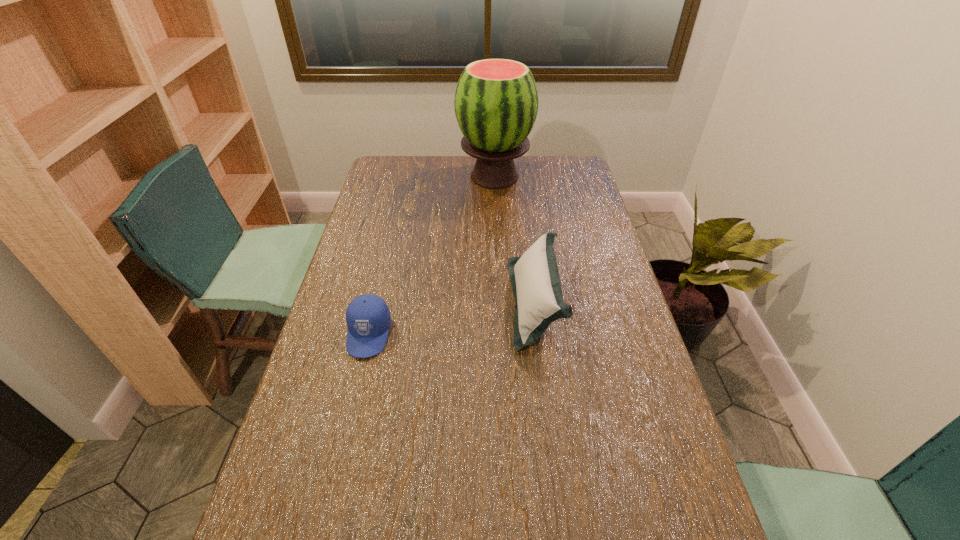
Locate which object is the closest to the second shortest object. Please provide its 2D coordinates. Your answer should be formatted as a tuple, i.e. [(x, y)], where the tuple contains the x and y coordinates of a point satisfying the conditions above.

[(368, 319)]

Point out which object is positioned as the nearest to the leftmost object. Please provide its 2D coordinates. Your answer should be formatted as a tuple, i.e. [(x, y)], where the tuple contains the x and y coordinates of a point satisfying the conditions above.

[(534, 276)]

Find the location of `free space in the image that satisfies the following two spatial constraints: 1. on the surface of the second tallest object; 2. on the front-facing side of the cap`. free space in the image that satisfies the following two spatial constraints: 1. on the surface of the second tallest object; 2. on the front-facing side of the cap is located at coordinates pos(539,334).

Locate an element on the screen. The image size is (960, 540). vacant space that satisfies the following two spatial constraints: 1. on the surface of the cushion; 2. on the front-facing side of the shortest object is located at coordinates (539, 334).